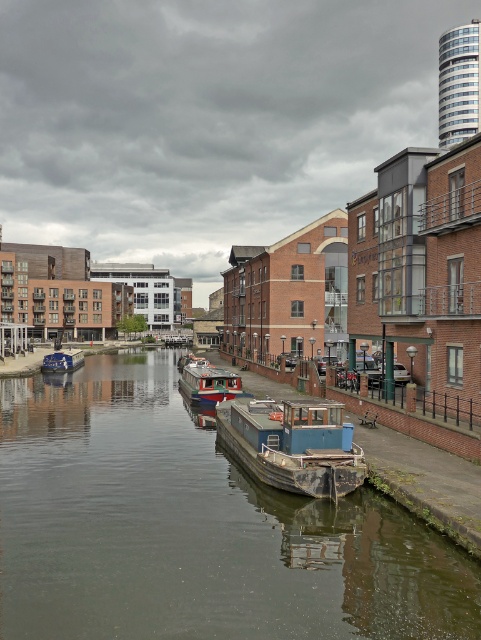
Question: Among these points, which one is farthest from the camera?

Choices:
 (A) (60, 362)
 (B) (191, 392)

Answer: (A)

Question: Does blue weathered barge at center lie in front of red glossy boat at center?

Choices:
 (A) no
 (B) yes

Answer: (B)

Question: Is smooth concrete river at center bigger than blue weathered barge at center?

Choices:
 (A) yes
 (B) no

Answer: (A)

Question: Based on their relative distances, which object is farther from the red glossy boat at center?

Choices:
 (A) blue weathered barge at center
 (B) blue matte barge at center
 (C) smooth concrete river at center

Answer: (B)

Question: Which of the following is the closest to the observer?

Choices:
 (A) blue matte barge at center
 (B) blue weathered barge at center
 (C) red glossy boat at center

Answer: (B)

Question: Is blue weathered barge at center behind blue matte barge at center?

Choices:
 (A) no
 (B) yes

Answer: (A)